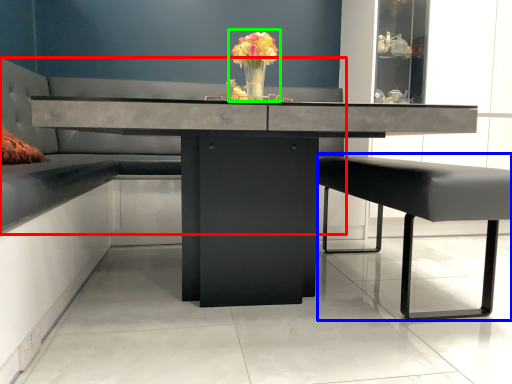
Question: Which object is positioned farthest from couch (highlighted by a red box)? Select from swivel chair (highlighted by a blue box) and floral arrangement (highlighted by a green box).

Choices:
 (A) swivel chair
 (B) floral arrangement

Answer: (A)